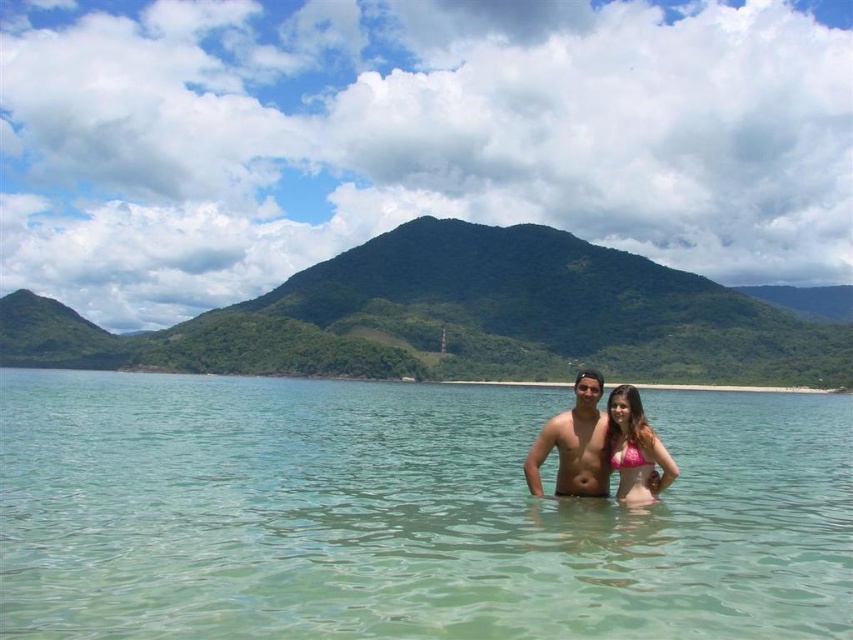
You are a photographer trying to capture a photo of the clear water at center and the pink bikini at center from a drone. The minimum safe distance for the drone to fly above the water is 50 meters. Can the drone safely capture both objects while maintaining this distance?

The distance between the clear water at center and the pink bikini at center is 77.71 meters. Since the minimum safe distance is 50 meters, the drone can safely capture both objects while maintaining the required altitude.

You are a photographer trying to capture the perfect shot of the two people in the water. You want to ensure that both the matte skin torso at center and the pink fabric bikini at center are clearly visible in your photo. Based on their positions, which object should you focus on first to ensure both are in focus?

The matte skin torso at center is located below the pink fabric bikini at center. To ensure both are in focus, you should focus on the pink fabric bikini at center first since it is closer to the camera, and the matte skin torso at center being lower might be further away, so focusing on the closer object first helps in maintaining sharpness for both.